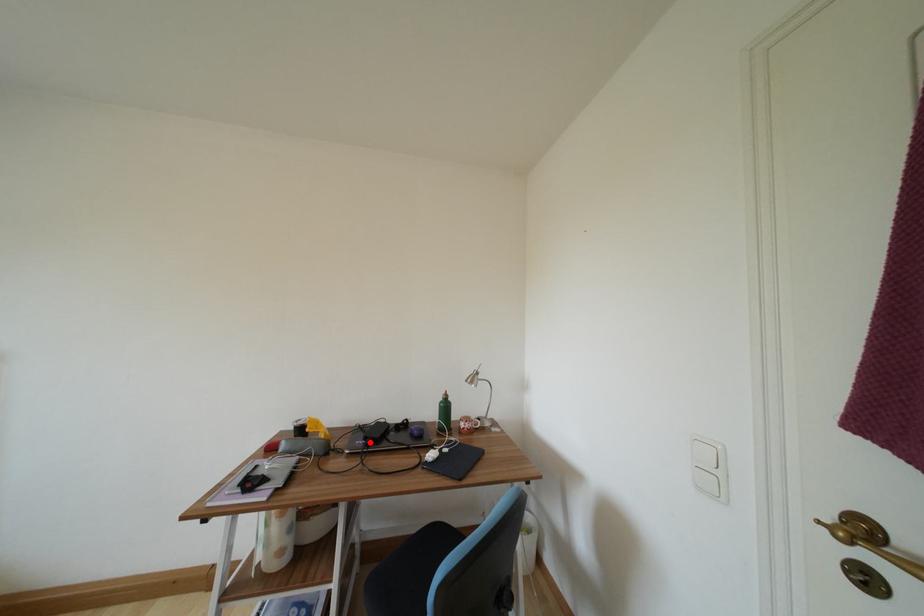
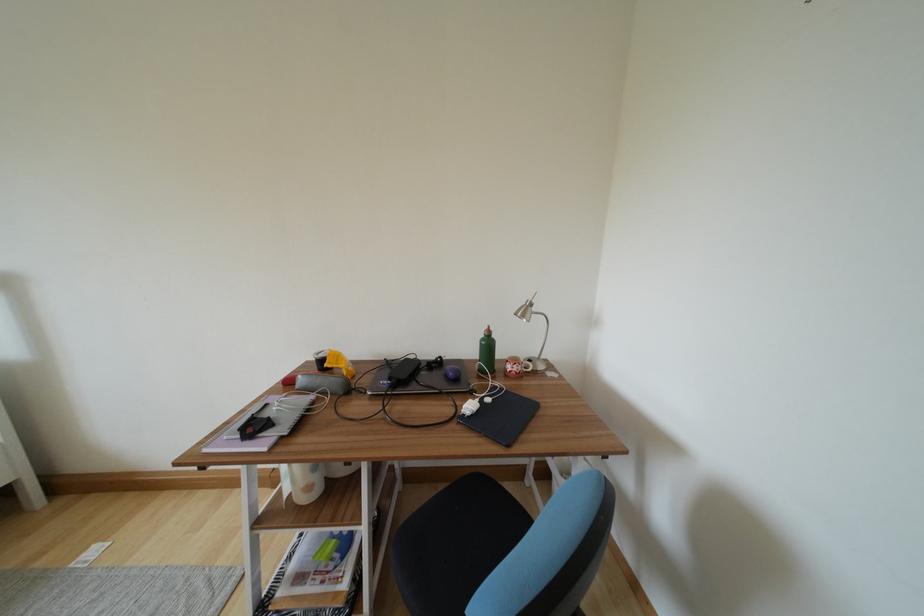
Find the pixel in the second image that matches the highlighted location in the first image.

(395, 382)